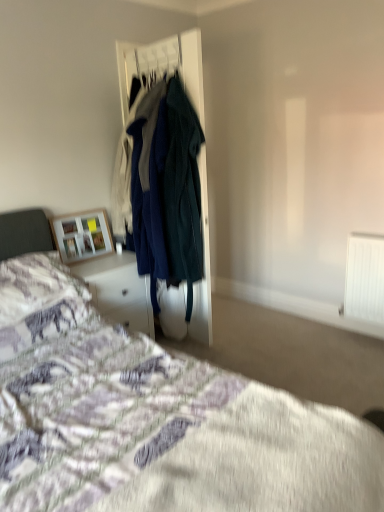
Identify the location of empty space that is ontop of wooden frame at upper left. This screenshot has width=384, height=512. (74, 207).